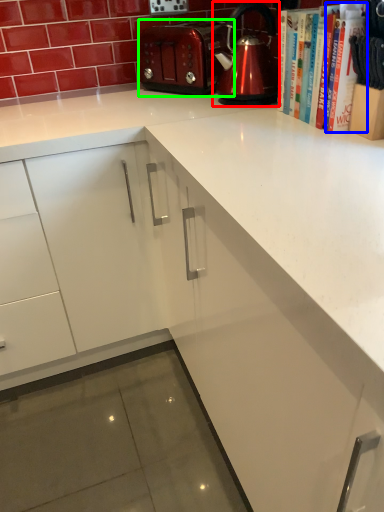
Question: Which object is the farthest from kettle (highlighted by a red box)? Choose among these: book (highlighted by a blue box) or toaster (highlighted by a green box).

Choices:
 (A) book
 (B) toaster

Answer: (A)